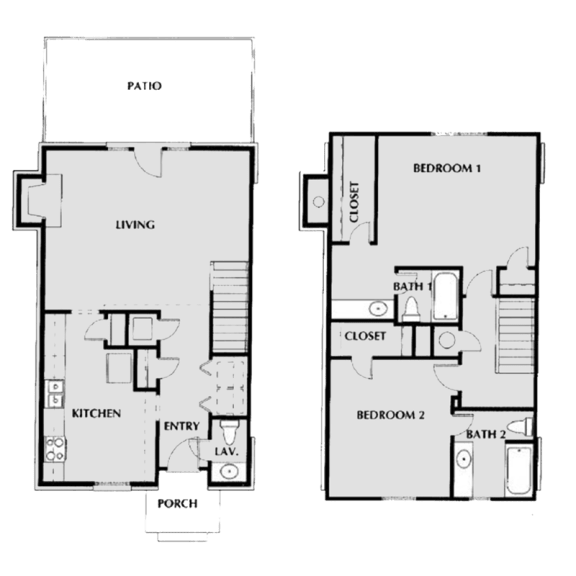
Locate an element on the screen. Image resolution: width=576 pixels, height=576 pixels. closets is located at coordinates (369, 338), (360, 188).